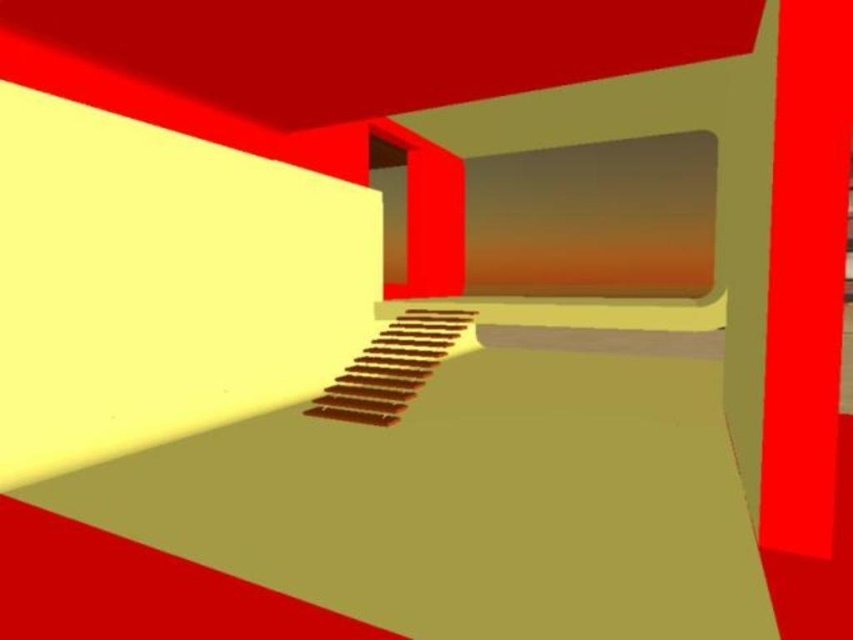
You are standing in the minimalist architectural space with red walls. You need to move from the entrance to the wooden stairs at center. Is the smooth glossy red pillar at right blocking your path?

The smooth glossy red pillar at right is closer to the viewer than the wooden stairs at center, so it may be blocking the path to the wooden stairs at center depending on its placement.

You are standing at the origin point in this minimalist room with red walls and beige floor. There are two points marked in the scene. The first point is at coordinates point (811, 166) and the second is at point (341, 374). Which point is closer to you when facing the direction of the room?

Point (811, 166) is in front of point (341, 374), so it is closer to you when facing the room direction.

You are an interior designer assessing the space. You need to place a large sculpture that requires a minimum of 2 meters of space. Which object between the smooth glossy red pillar at right and the wooden stairs at center would you avoid placing the sculpture near to ensure enough space?

You should avoid placing the sculpture near the smooth glossy red pillar at right because it has a smaller size compared to the wooden stairs at center, meaning there is less space around the pillar.